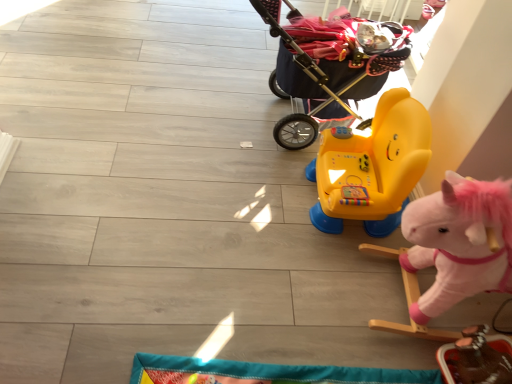
I want to click on vacant space to the left of fluffy pink rocking horse at right, the 2th toy when ordered from bottom to top, so click(x=313, y=292).